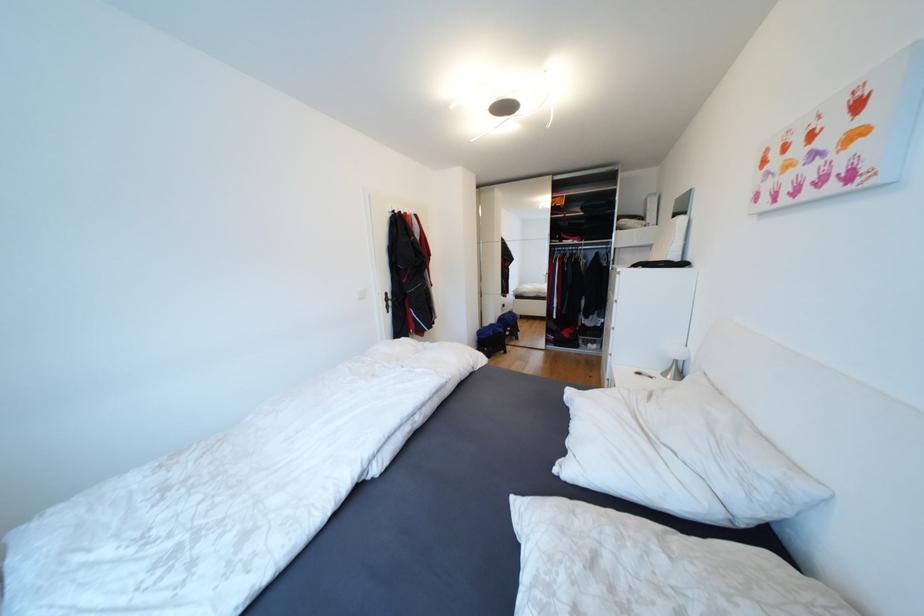
Where would you turn the silver door handle? Please return your answer as a coordinate pair (x, y).

(386, 302)